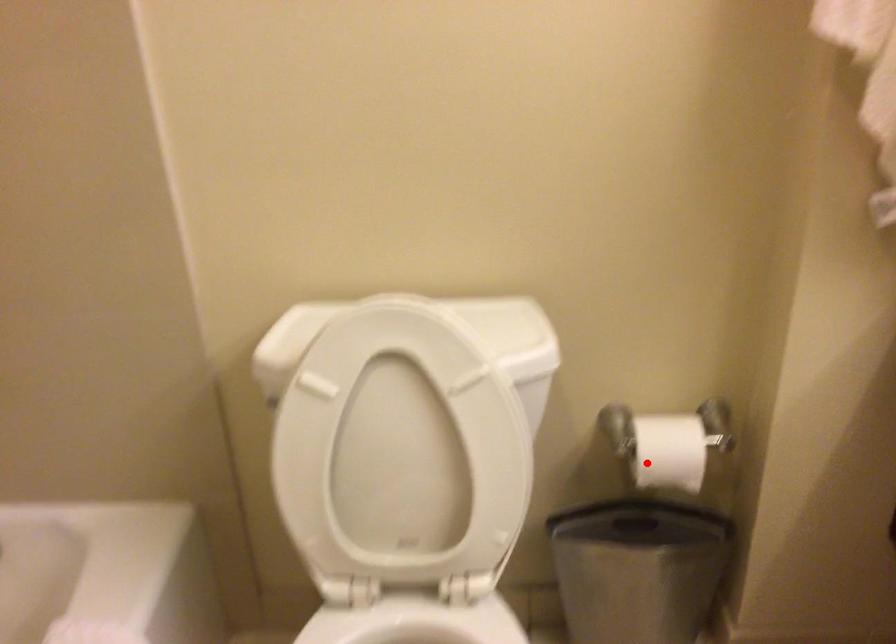
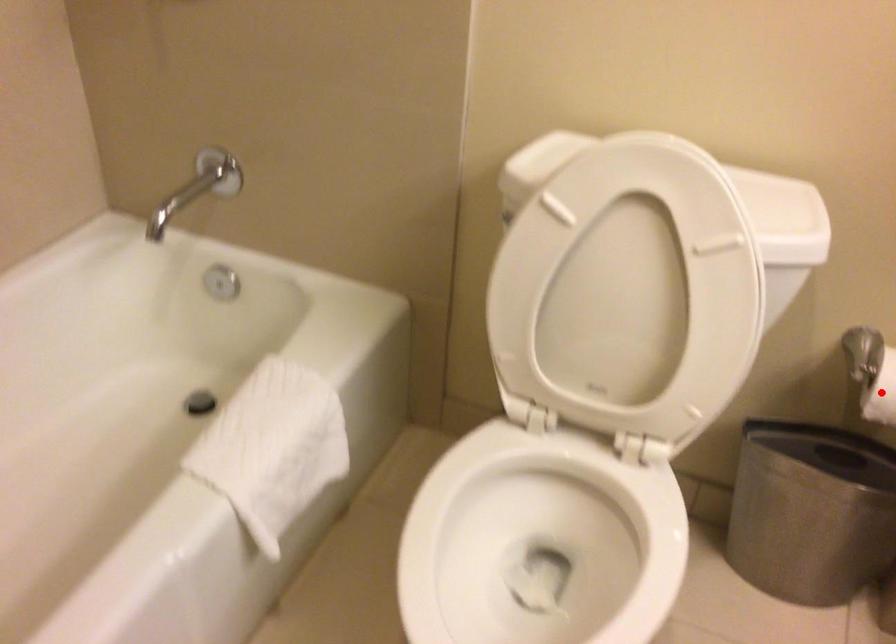
I am providing you with two images of the same scene from different viewpoints. A red point is marked on the first image and another point is marked on the second image. Does the point marked in image1 correspond to the same location as the one in image2?

Yes